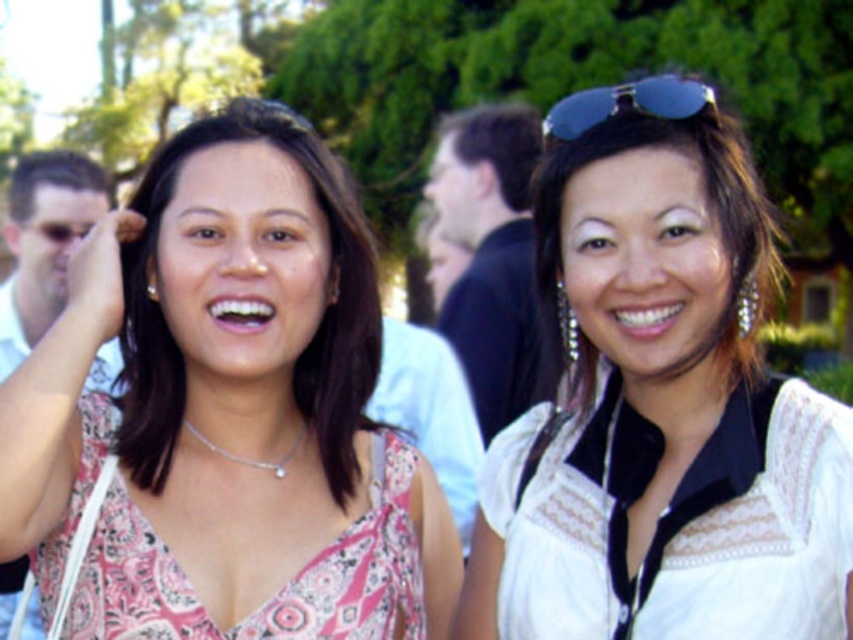
Question: Which object is closer to the camera taking this photo?

Choices:
 (A) pink printed fabric dress at center
 (B) white lace blouse at center
 (C) white lace bikini top at upper right
 (D) blue reflective sunglasses at upper right

Answer: (C)

Question: Is white lace blouse at center above pink printed dress at center?

Choices:
 (A) yes
 (B) no

Answer: (B)

Question: Which of the following is the farthest from the observer?

Choices:
 (A) white lace bikini top at upper right
 (B) pink printed fabric dress at center

Answer: (B)

Question: Observing the image, what is the correct spatial positioning of white lace blouse at center in reference to pink printed fabric dress at center?

Choices:
 (A) below
 (B) above

Answer: (B)

Question: Is white lace blouse at center closer to camera compared to pink printed dress at center?

Choices:
 (A) yes
 (B) no

Answer: (A)

Question: Considering the real-world distances, which object is closest to the white lace bikini top at upper right?

Choices:
 (A) pink printed dress at center
 (B) white lace blouse at center
 (C) blue reflective sunglasses at upper right

Answer: (B)